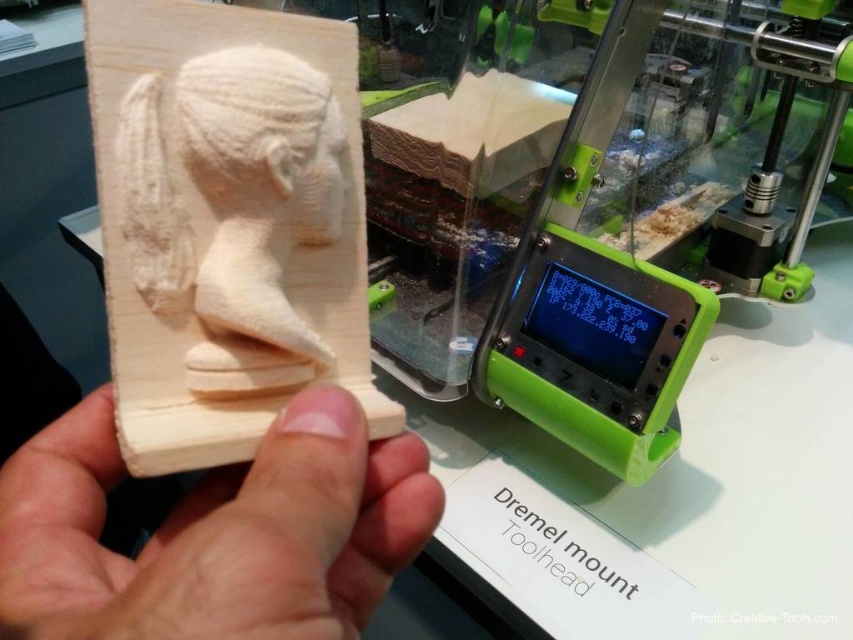
Does wooden sculpture at center appear on the left side of white wood carving at center?

Yes, wooden sculpture at center is to the left of white wood carving at center.

What do you see at coordinates (231, 205) in the screenshot? The width and height of the screenshot is (853, 640). I see `wooden sculpture at center` at bounding box center [231, 205].

The width and height of the screenshot is (853, 640). In order to click on wooden sculpture at center in this screenshot , I will do `click(231, 205)`.

Can you confirm if light wood at center is bigger than white wood carving at center?

Yes.

Does light wood at center have a lesser height compared to white wood carving at center?

Correct, light wood at center is not as tall as white wood carving at center.

The image size is (853, 640). What are the coordinates of `light wood at center` in the screenshot? It's located at (215, 531).

Does light wood at center have a greater height compared to wooden sculpture at center?

No.

I want to click on light wood at center, so click(215, 531).

This screenshot has height=640, width=853. Find the location of `light wood at center`. light wood at center is located at coordinates (215, 531).